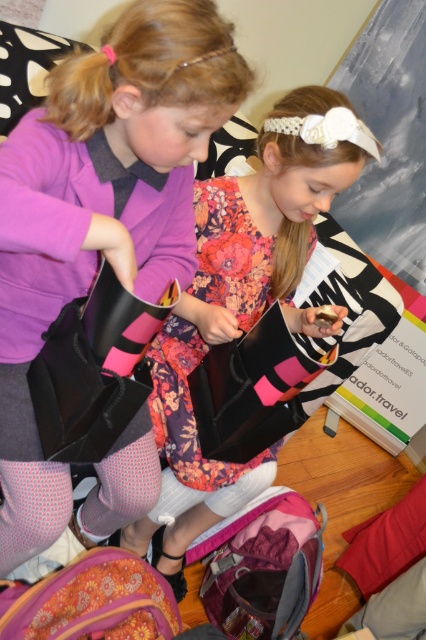
Describe the element at coordinates (100, 211) in the screenshot. I see `matte black bag at center` at that location.

Which is behind, point (11, 316) or point (265, 269)?

The point (265, 269) is more distant.

Looking at this image, who is more distant from viewer, [176,182] or [310,193]?

The point [310,193] is behind.

Identify the location of matte black bag at center. (100, 211).